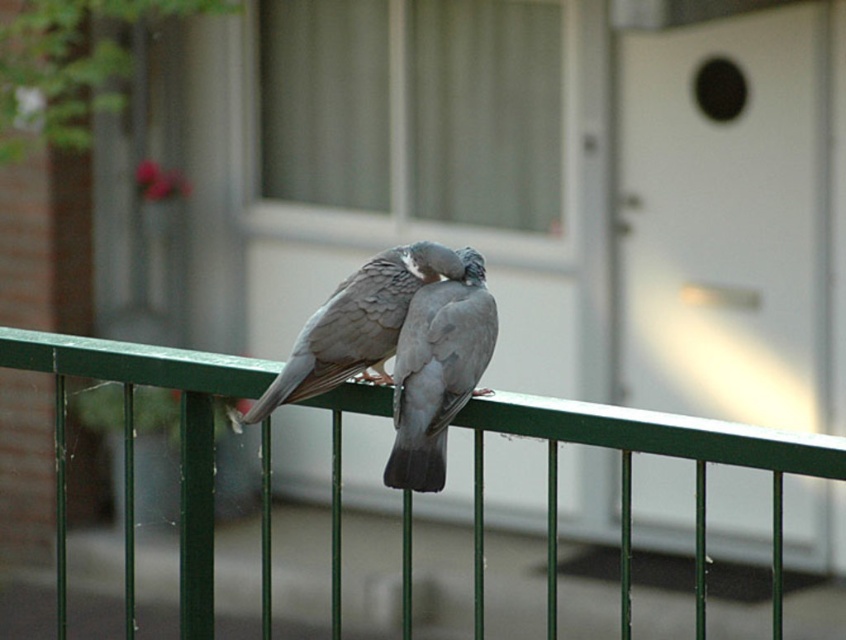
Is point (751, 444) less distant than point (375, 369)?

That is True.

Based on the photo, is green metal fence at center thinner than gray matte dove at center?

No, green metal fence at center is not thinner than gray matte dove at center.

Is point (91, 362) positioned after point (344, 356)?

Yes.

Locate an element on the screen. green metal fence at center is located at coordinates (630, 476).

Can you confirm if gray matte pigeon at center is taller than gray matte dove at center?

Correct, gray matte pigeon at center is much taller as gray matte dove at center.

You are a GUI agent. You are given a task and a screenshot of the screen. Output one action in this format:
    pyautogui.click(x=<x>, y=<y>)
    Task: Click on the gray matte pigeon at center
    The width and height of the screenshot is (846, 640).
    Given the screenshot: What is the action you would take?
    pyautogui.click(x=438, y=371)

The image size is (846, 640). I want to click on gray matte pigeon at center, so click(x=438, y=371).

Which of these two, green metal fence at center or gray matte pigeon at center, stands taller?

green metal fence at center

Between green metal fence at center and gray matte pigeon at center, which one has less height?

gray matte pigeon at center is shorter.

Is point (779, 554) less distant than point (440, 464)?

Yes.

Locate an element on the screen. This screenshot has height=640, width=846. green metal fence at center is located at coordinates (630, 476).